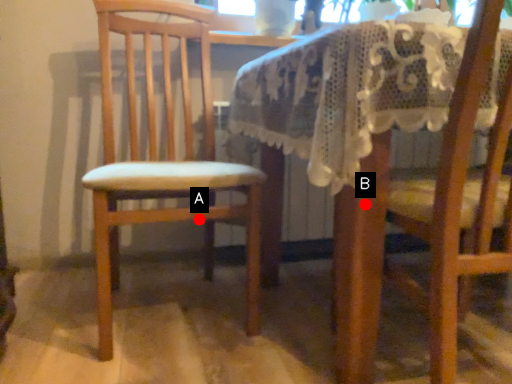
Question: Two points are circled on the image, labeled by A and B beside each circle. Which point appears farthest from the camera in this image?

Choices:
 (A) A is further
 (B) B is further

Answer: (A)